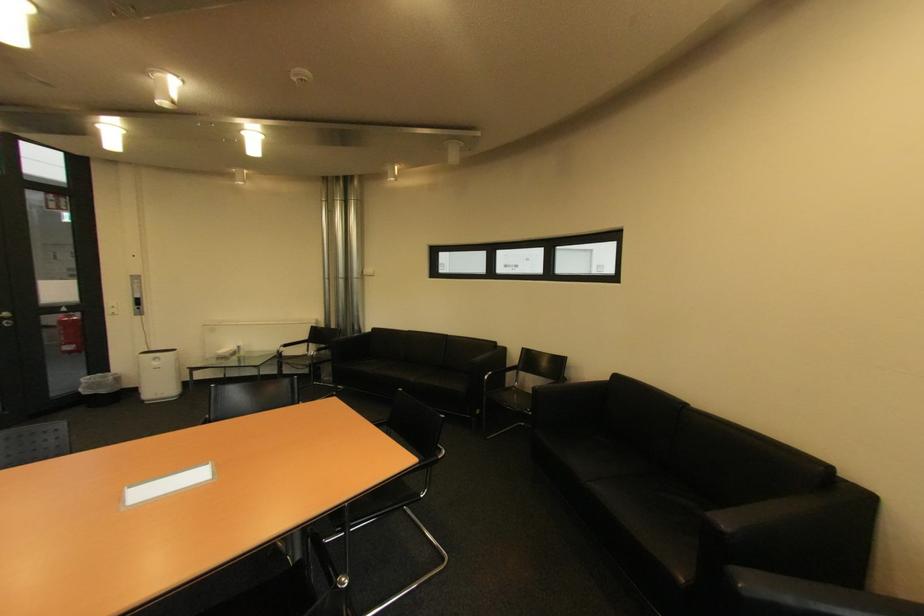
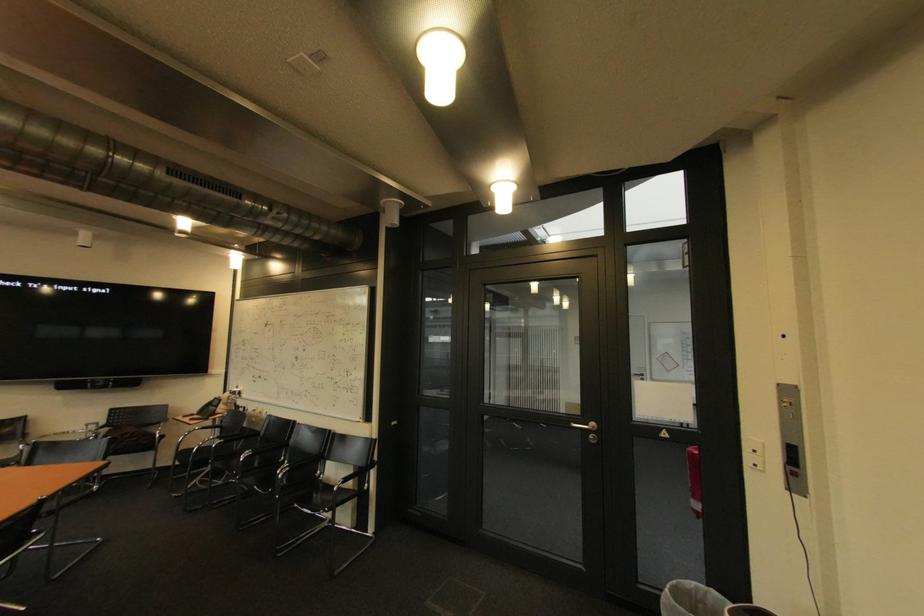
In the second image, find the point that corresponds to point 96,379 in the first image.

(701, 585)